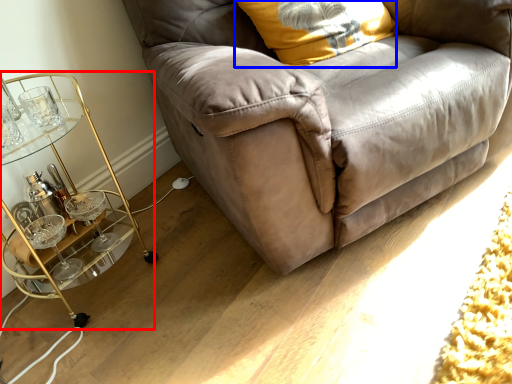
Question: Which of the following is the closest to the observer, table (highlighted by a red box) or pillow (highlighted by a blue box)?

Choices:
 (A) table
 (B) pillow

Answer: (A)